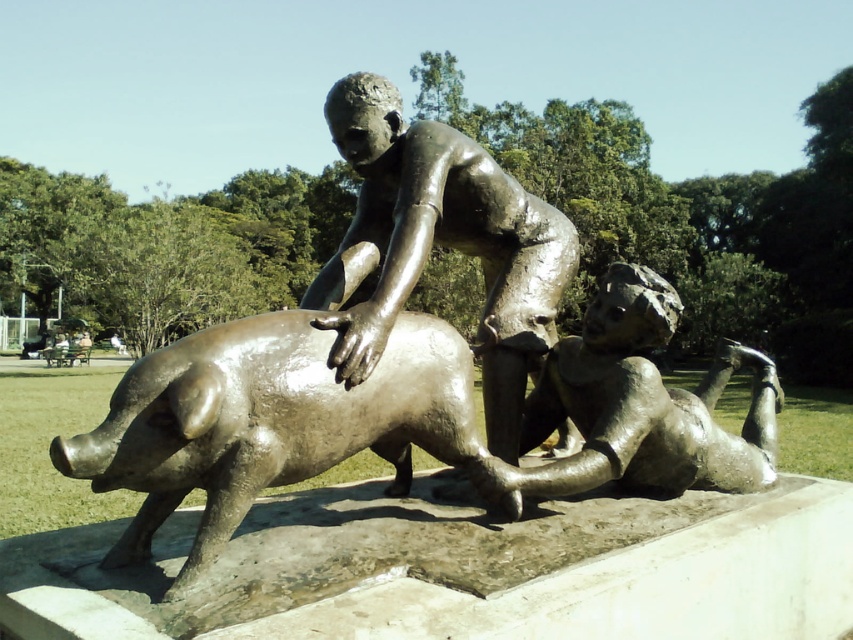
Measure the distance between point (397,227) and camera.

Point (397,227) is 9.66 feet from camera.

Identify the location of bronze pig at center. This screenshot has height=640, width=853. (349, 324).

Is point (440, 195) behind point (518, 433)?

No, (440, 195) is in front of (518, 433).

Is bronze pig at center above bronze statue at center?

No, bronze pig at center is not above bronze statue at center.

Does point (428, 227) come closer to viewer compared to point (500, 168)?

Yes, it is.

At what (x,y) coordinates should I click in order to perform the action: click on bronze pig at center. Please return your answer as a coordinate pair (x, y). Looking at the image, I should click on (349, 324).

Who is shorter, shiny bronze pig at center or bronze figure at lower right?

shiny bronze pig at center is shorter.

The height and width of the screenshot is (640, 853). What are the coordinates of `shiny bronze pig at center` in the screenshot? It's located at (265, 420).